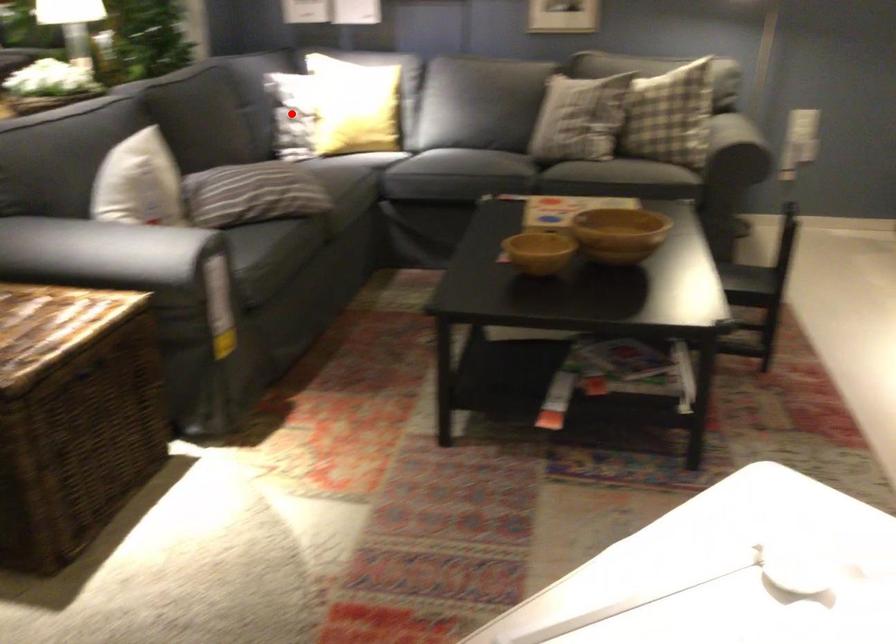
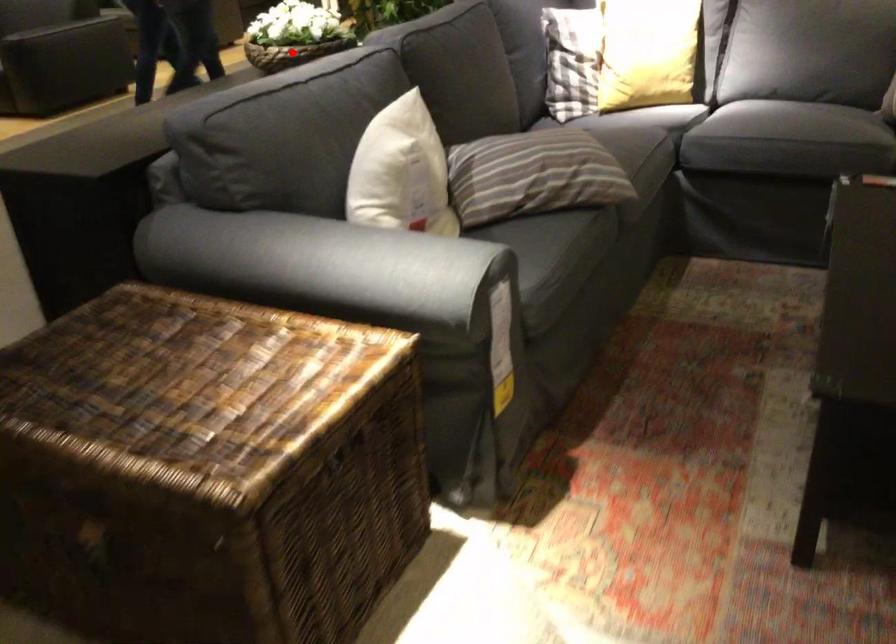
I am providing you with two images of the same scene from different viewpoints. A red point is marked on the first image and another point is marked on the second image. Is the marked point in image1 the same physical position as the marked point in image2?

No